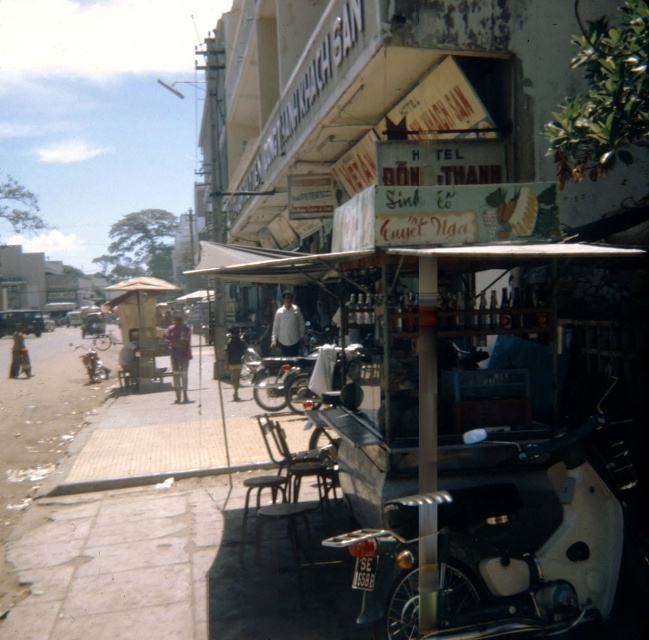
Question: Which point is closer to the camera?

Choices:
 (A) light brown leather jacket at center
 (B) white matte motorcycle at center
 (C) shiny chrome motorcycle at left
 (D) light brown leather jacket at lower left

Answer: (B)

Question: From the image, what is the correct spatial relationship of white matte motorcycle at center in relation to purple fabric shirt at center?

Choices:
 (A) below
 (B) above

Answer: (A)

Question: Considering the relative positions of light brown leather jacket at center and shiny chrome motorcycle at left in the image provided, where is light brown leather jacket at center located with respect to shiny chrome motorcycle at left?

Choices:
 (A) right
 (B) left

Answer: (A)

Question: Based on their relative distances, which object is nearer to the light brown leather jacket at center?

Choices:
 (A) white shirt at center
 (B) purple fabric shirt at center

Answer: (B)

Question: Which point is farther to the camera?

Choices:
 (A) purple fabric shirt at center
 (B) white matte motorcycle at center
 (C) light brown leather jacket at lower left

Answer: (C)

Question: Can you confirm if white matte motorcycle at center is positioned above shiny chrome motorcycle at left?

Choices:
 (A) yes
 (B) no

Answer: (B)